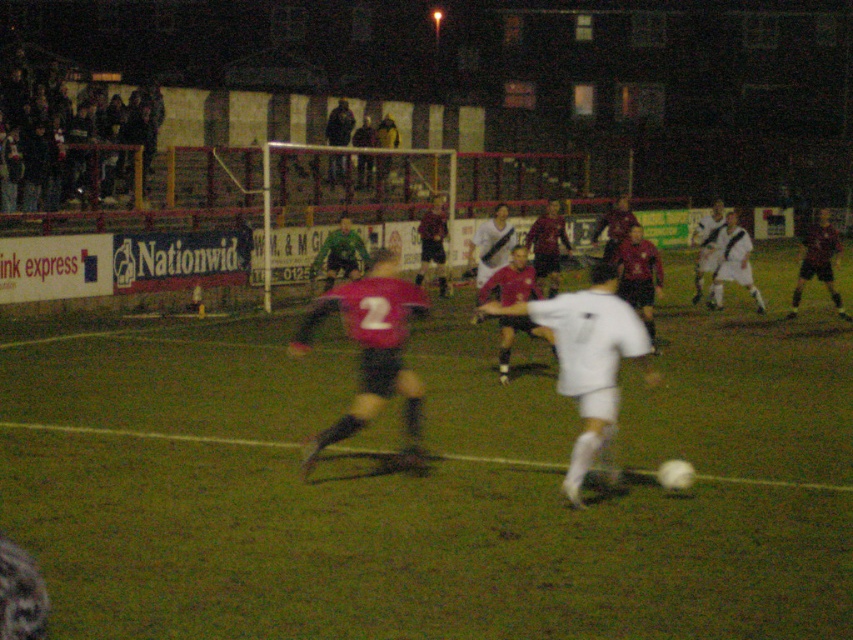
Question: Which point is farther to the camera?

Choices:
 (A) (605, 284)
 (B) (289, 348)
 (C) (514, 538)
 (D) (329, 241)

Answer: (D)

Question: Does white matte soccer player at center have a lesser width compared to dark red jersey at center?

Choices:
 (A) no
 (B) yes

Answer: (B)

Question: Which of the following is the farthest from the observer?

Choices:
 (A) click(790, 310)
 (B) click(605, 435)
 (C) click(328, 280)

Answer: (A)

Question: Is white matte soccer player at center to the right of dark red jersey at center from the viewer's perspective?

Choices:
 (A) yes
 (B) no

Answer: (B)

Question: Estimate the real-world distances between objects in this image. Which object is farther from the green jersey at center?

Choices:
 (A) dark red jersey at center
 (B) matte red jersey at center
 (C) white matte soccer player at center

Answer: (C)

Question: Is matte red jersey at center positioned in front of green jersey at center?

Choices:
 (A) yes
 (B) no

Answer: (A)